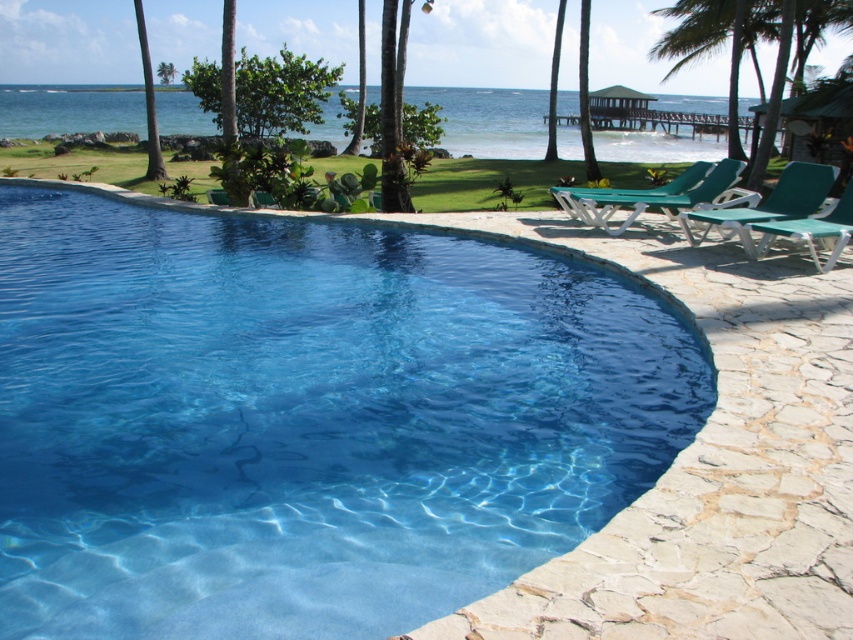
You are planning to place a new small table between the green leafy palm tree at upper right and the green fabric beach chair at right. Which object should the table be closer to to ensure it fits properly?

The table should be placed closer to the green fabric beach chair at right because the green leafy palm tree at upper right is wider than the green fabric beach chair at right, so positioning the table near the narrower object allows for better fit.

You are standing at the edge of the swimming pool and see two points marked in the scene. Which point, point (817, 205) or point (688, 205), is closer to you?

Point (817, 205) is closer to the camera than point (688, 205), so it is closer to you.

Looking at this image, you are designing a layout for a new tropical resort and need to place a large statue between the transparent glass pool at center and the green leafy palm tree at upper right. Based on their sizes, which object should the statue be closer to?

The transparent glass pool at center is thinner than the green leafy palm tree at upper right, so the statue should be placed closer to the transparent glass pool at center to balance their sizes.